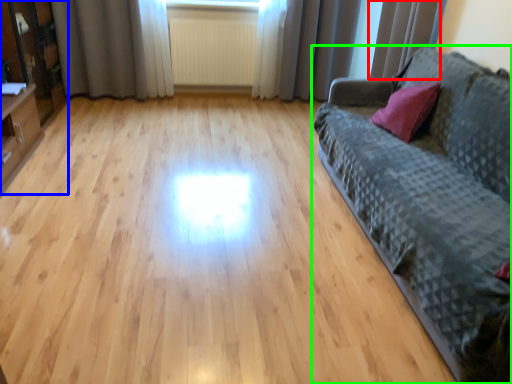
Question: Based on their relative distances, which object is farther from curtain (highlighted by a red box)? Choose from entertainment center (highlighted by a blue box) and studio couch (highlighted by a green box).

Choices:
 (A) entertainment center
 (B) studio couch

Answer: (A)